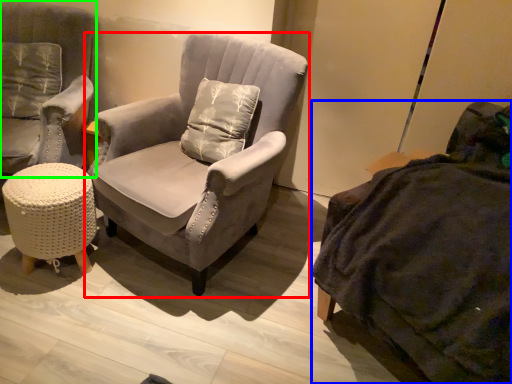
Question: Which object is positioned farthest from chair (highlighted by a red box)? Select from studio couch (highlighted by a blue box) and chair (highlighted by a green box).

Choices:
 (A) studio couch
 (B) chair

Answer: (A)